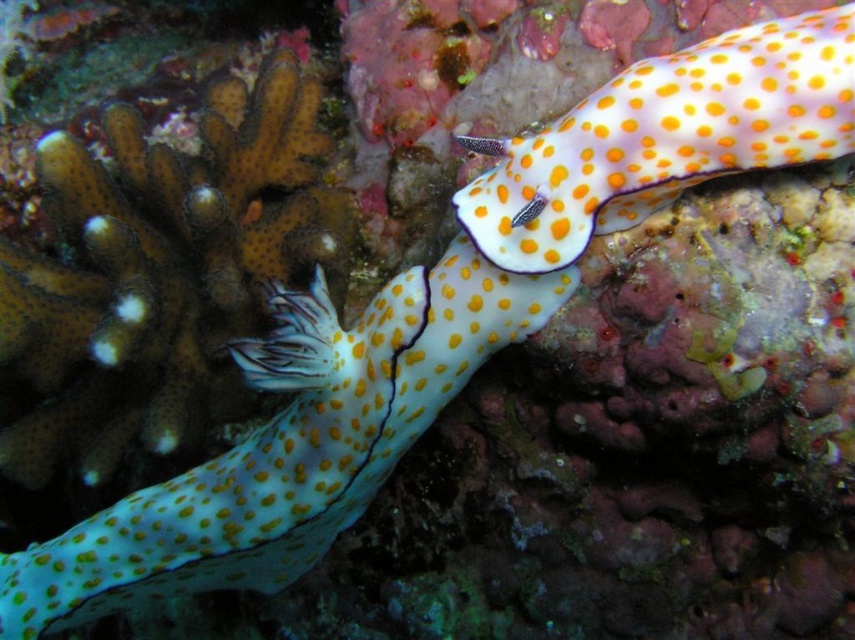
Which is above, translucent yellow spotted sea slug at center or orange dotted shell at upper right?

orange dotted shell at upper right is above.

Can you confirm if translucent yellow spotted sea slug at center is taller than orange dotted shell at upper right?

Correct, translucent yellow spotted sea slug at center is much taller as orange dotted shell at upper right.

From the picture: Who is more forward, (x=37, y=577) or (x=647, y=108)?

Point (x=647, y=108)

Find the location of a particular element. The width and height of the screenshot is (855, 640). translucent yellow spotted sea slug at center is located at coordinates pos(289,444).